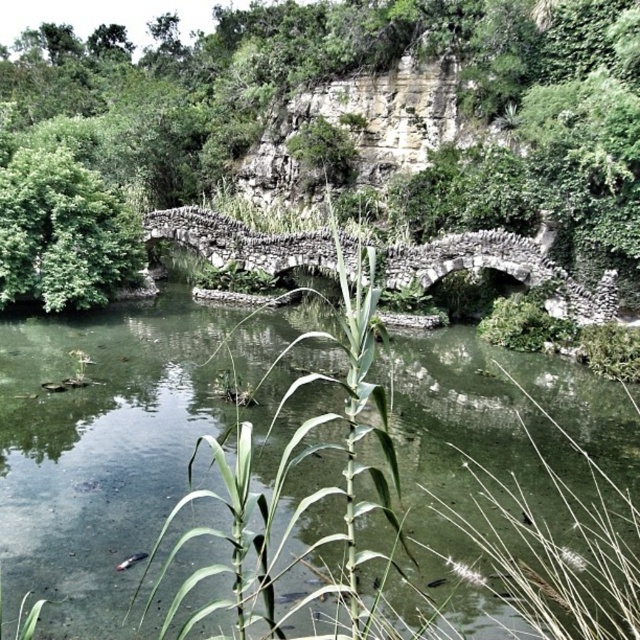
Is green stone bridge at center bigger than green leafy tree at center?

Actually, green stone bridge at center might be smaller than green leafy tree at center.

Is green stone bridge at center taller than green leafy tree at center?

No.

Is point (220, 355) farther from camera compared to point (637, 195)?

Yes, it is behind point (637, 195).

Locate an element on the screen. Image resolution: width=640 pixels, height=640 pixels. green stone bridge at center is located at coordinates (113, 448).